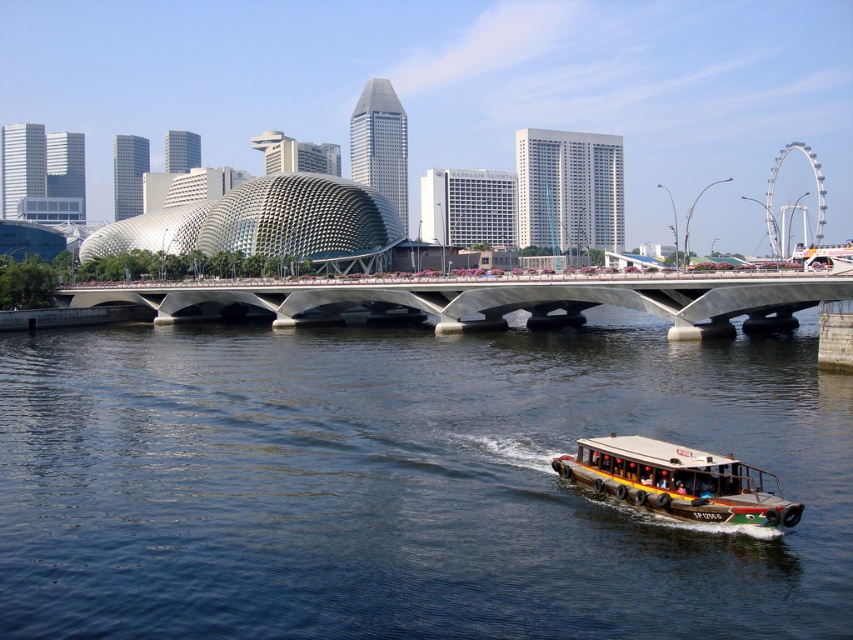
Measure the distance between concrete bridge at center and camera.

concrete bridge at center is 68.22 meters away from camera.

Does point (390, 288) lie in front of point (682, 506)?

No, (390, 288) is further to viewer.

You are a GUI agent. You are given a task and a screenshot of the screen. Output one action in this format:
    pyautogui.click(x=<x>, y=<y>)
    Task: Click on the concrete bridge at center
    The width and height of the screenshot is (853, 640).
    Given the screenshot: What is the action you would take?
    pyautogui.click(x=489, y=300)

Is dark blue water at center to the right of yellow-green painted wooden boat at lower right from the viewer's perspective?

No, dark blue water at center is not to the right of yellow-green painted wooden boat at lower right.

Is point (753, 604) closer to camera compared to point (625, 442)?

Yes, it is.

Where is `dark blue water at center`? dark blue water at center is located at coordinates (405, 483).

Can you confirm if dark blue water at center is positioned to the right of concrete bridge at center?

Correct, you'll find dark blue water at center to the right of concrete bridge at center.

Can you confirm if dark blue water at center is bigger than concrete bridge at center?

Yes.

Where is `dark blue water at center`? dark blue water at center is located at coordinates (405, 483).

Locate an element on the screen. dark blue water at center is located at coordinates (405, 483).